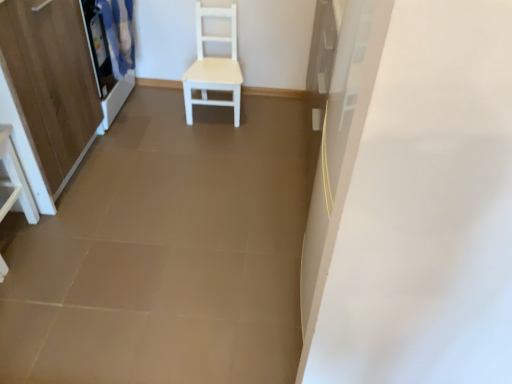
Question: Is wooden cabinet at left taller or shorter than matte white curtain at upper left?

Choices:
 (A) tall
 (B) short

Answer: (A)

Question: Considering their positions, is wooden cabinet at left located in front of or behind matte white curtain at upper left?

Choices:
 (A) behind
 (B) front

Answer: (B)

Question: Which object is positioned farthest from the white matte chair at center?

Choices:
 (A) wooden cabinet at left
 (B) white glossy vanity at lower left
 (C) matte white curtain at upper left

Answer: (B)

Question: Considering the real-world distances, which object is closest to the white matte chair at center?

Choices:
 (A) matte white curtain at upper left
 (B) wooden cabinet at left
 (C) white glossy vanity at lower left

Answer: (A)